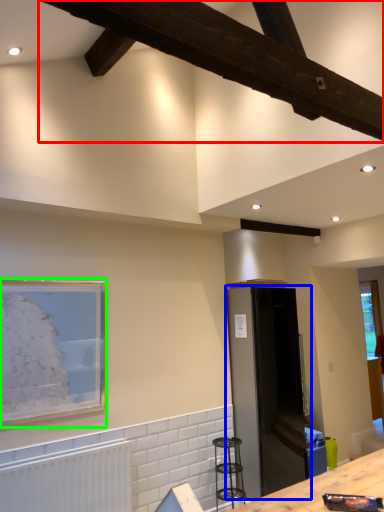
Question: Which is nearer to the exhaust hood (highlighted by a red box)? appliance (highlighted by a blue box) or picture frame (highlighted by a green box).

Choices:
 (A) appliance
 (B) picture frame

Answer: (B)